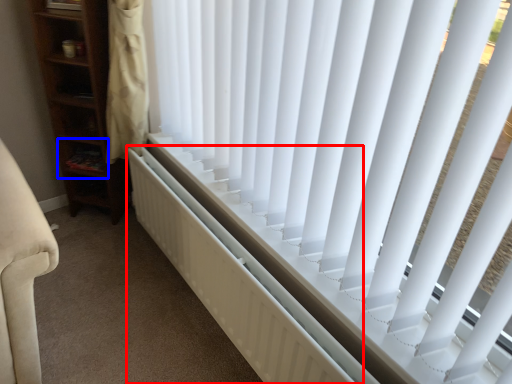
Question: Which of the following is the closest to the observer, radiator (highlighted by a red box) or shelf (highlighted by a blue box)?

Choices:
 (A) radiator
 (B) shelf

Answer: (A)